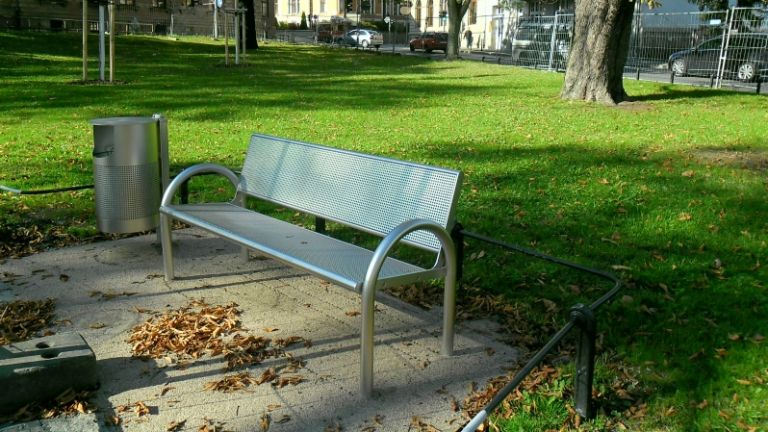
The height and width of the screenshot is (432, 768). I want to click on bench legs, so [448, 304], [365, 358], [167, 245], [243, 257].